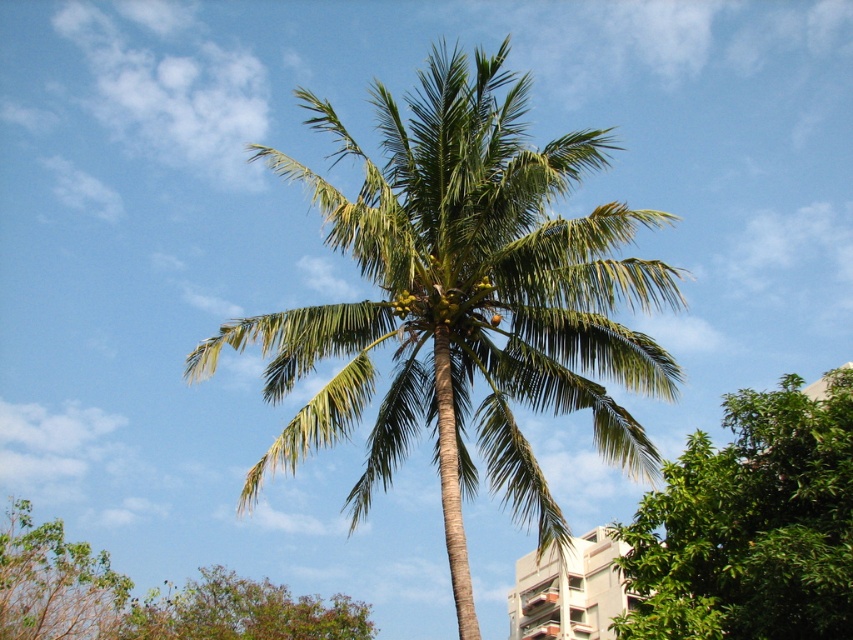
Question: Is brown leafy tree at lower left behind green leafy tree at lower left?

Choices:
 (A) yes
 (B) no

Answer: (B)

Question: Which of these objects is positioned closest to the green leafy palm tree at center?

Choices:
 (A) green leafy tree at lower left
 (B) brown leafy tree at lower left

Answer: (A)

Question: Can you confirm if brown leafy tree at lower left is smaller than green leafy tree at lower left?

Choices:
 (A) no
 (B) yes

Answer: (A)

Question: Estimate the real-world distances between objects in this image. Which object is closer to the green leafy palm tree at center?

Choices:
 (A) green leafy tree at center
 (B) brown leafy tree at lower left
 (C) green leafy tree at lower left

Answer: (A)

Question: Can you confirm if green leafy palm tree at center is positioned above green leafy tree at lower left?

Choices:
 (A) no
 (B) yes

Answer: (B)

Question: Considering the real-world distances, which object is farthest from the green leafy tree at lower left?

Choices:
 (A) brown leafy tree at lower left
 (B) green leafy palm tree at center

Answer: (B)